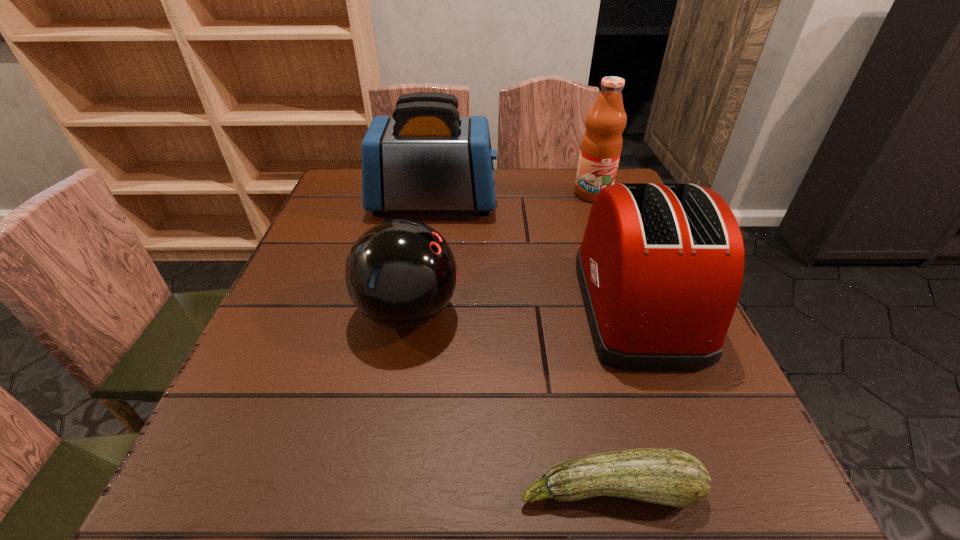
At what (x,y) coordinates should I click in order to perform the action: click on free space between the nearest object and the bowling ball. Please return your answer as a coordinate pair (x, y). This screenshot has width=960, height=540. Looking at the image, I should click on (509, 401).

Where is `empty space between the fourth tallest object and the nearer toaster`? The image size is (960, 540). empty space between the fourth tallest object and the nearer toaster is located at coordinates (522, 308).

In order to click on vacant region between the left toaster and the right toaster in this screenshot , I will do `click(535, 253)`.

Identify the location of blank region between the farther toaster and the right toaster. pyautogui.click(x=535, y=253).

Identify the location of empty space between the second shortest object and the nearer toaster. This screenshot has height=540, width=960. (522, 308).

Identify which object is located as the second nearest to the bowling ball. Please provide its 2D coordinates. Your answer should be formatted as a tuple, i.e. [(x, y)], where the tuple contains the x and y coordinates of a point satisfying the conditions above.

[(665, 476)]

Locate which object is the third closest to the farther toaster. Please provide its 2D coordinates. Your answer should be formatted as a tuple, i.e. [(x, y)], where the tuple contains the x and y coordinates of a point satisfying the conditions above.

[(601, 145)]

Where is `vacant space that satisfies the following two spatial constraints: 1. on the front side of the right toaster; 2. on the surface of the second shortest object near the finger holes`? vacant space that satisfies the following two spatial constraints: 1. on the front side of the right toaster; 2. on the surface of the second shortest object near the finger holes is located at coordinates (639, 313).

I want to click on free space that satisfies the following two spatial constraints: 1. on the front-facing side of the nearer toaster; 2. on the left side of the farther toaster, so click(419, 304).

The height and width of the screenshot is (540, 960). In order to click on vacant point that satisfies the following two spatial constraints: 1. on the front label of the fruit juice; 2. on the left side of the right toaster in this screenshot , I will do `click(634, 304)`.